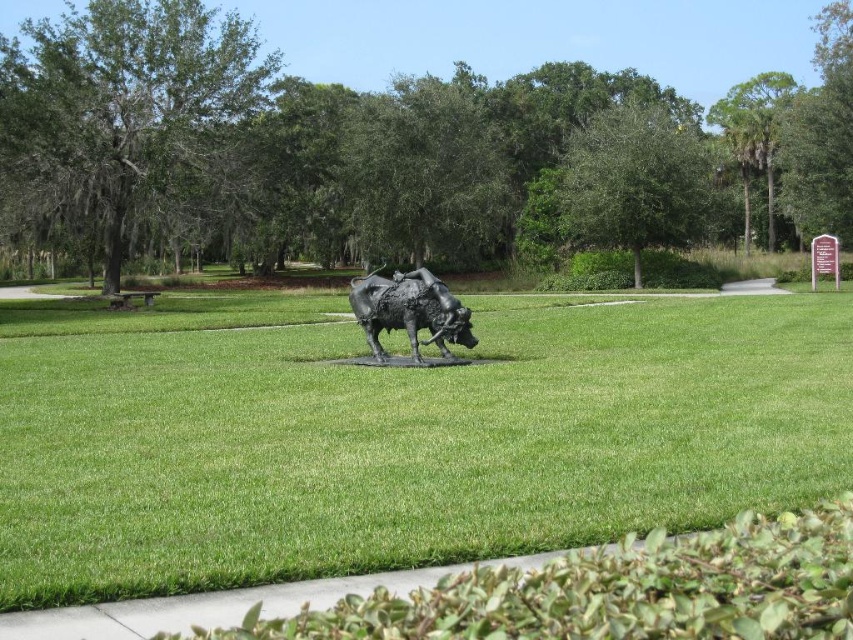
You are standing at the point marked by coordinates [405,442] in the park. What type of terrain are you currently standing on?

The point at coordinates [405,442] corresponds to green grass at center, so you are standing on green grass.

You are a gardener who wants to mow the green grass at center and clean around the bronze statue at center. Based on their heights, which one should you mow first?

The green grass at center is shorter than the bronze statue at center, so you should mow the green grass at center first before cleaning around the bronze statue at center.